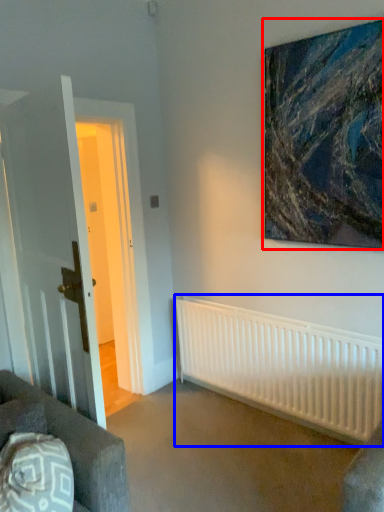
Question: Which of the following is the farthest to the observer, picture frame (highlighted by a red box) or radiator (highlighted by a blue box)?

Choices:
 (A) picture frame
 (B) radiator

Answer: (B)